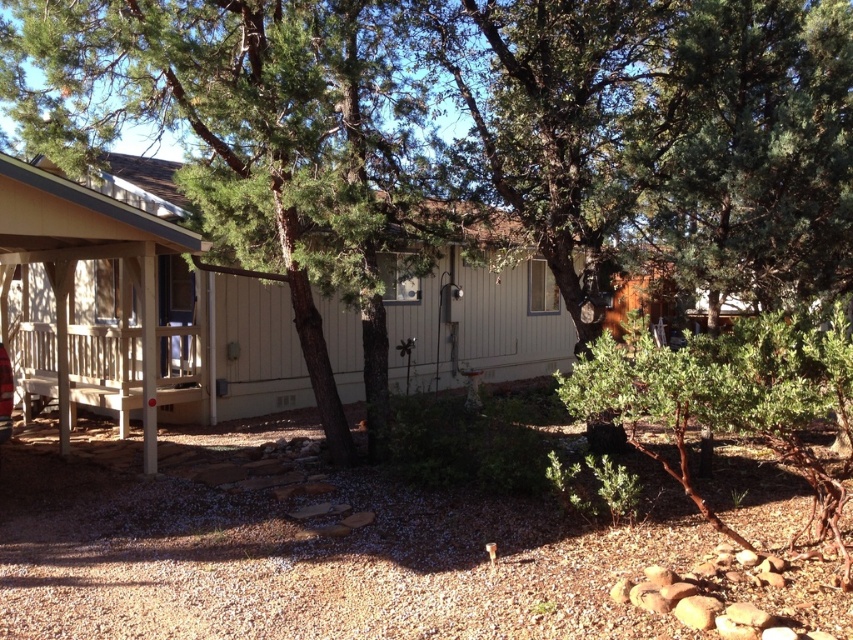
Question: Is green leafy tree at center bigger than metallic red car at lower left?

Choices:
 (A) yes
 (B) no

Answer: (B)

Question: Which point is farther to the camera?

Choices:
 (A) beige wood porch at lower left
 (B) metallic red car at lower left
 (C) green leafy tree at center

Answer: (C)

Question: Which of the following is the closest to the observer?

Choices:
 (A) (10, 387)
 (B) (525, 337)
 (C) (579, 192)

Answer: (A)

Question: Which is nearer to the beige wood porch at lower left?

Choices:
 (A) metallic red car at lower left
 (B) green leafy tree at center

Answer: (A)

Question: In this image, where is green leafy tree at center located relative to metallic red car at lower left?

Choices:
 (A) above
 (B) below

Answer: (A)

Question: Is beige wood porch at lower left below metallic red car at lower left?

Choices:
 (A) no
 (B) yes

Answer: (A)